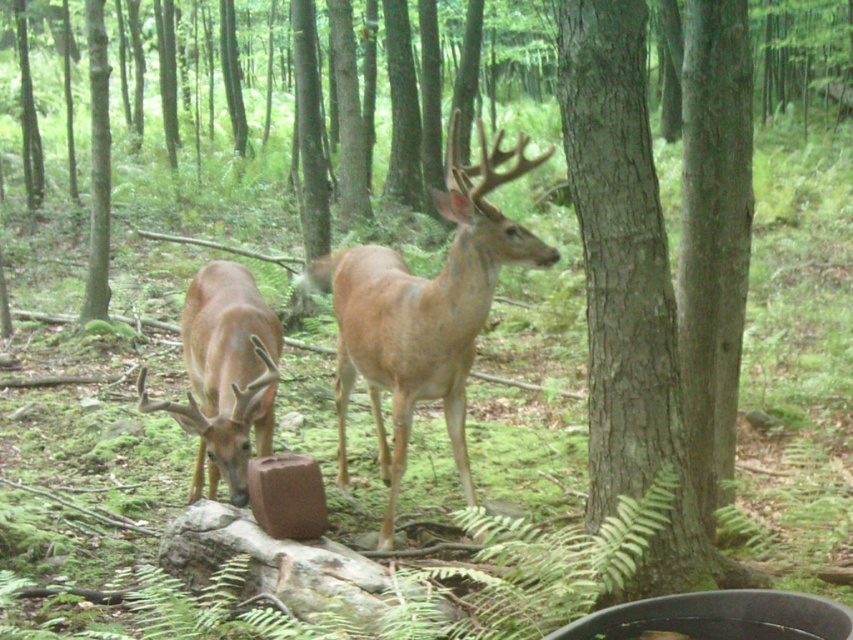
Question: Among these points, which one is farthest from the camera?

Choices:
 (A) click(x=698, y=586)
 (B) click(x=474, y=248)

Answer: (B)

Question: Is brown rough bark tree at center to the right of brown matte deer at left from the viewer's perspective?

Choices:
 (A) yes
 (B) no

Answer: (A)

Question: Where is light brown fur at center located in relation to brown matte deer at left in the image?

Choices:
 (A) below
 (B) above

Answer: (B)

Question: Estimate the real-world distances between objects in this image. Which object is closer to the brown matte deer at left?

Choices:
 (A) brown rough bark tree at center
 (B) light brown fur at center

Answer: (B)

Question: Is light brown fur at center wider than brown matte deer at left?

Choices:
 (A) no
 (B) yes

Answer: (A)

Question: Which point appears farthest from the camera in this image?

Choices:
 (A) (482, 291)
 (B) (236, 365)

Answer: (B)